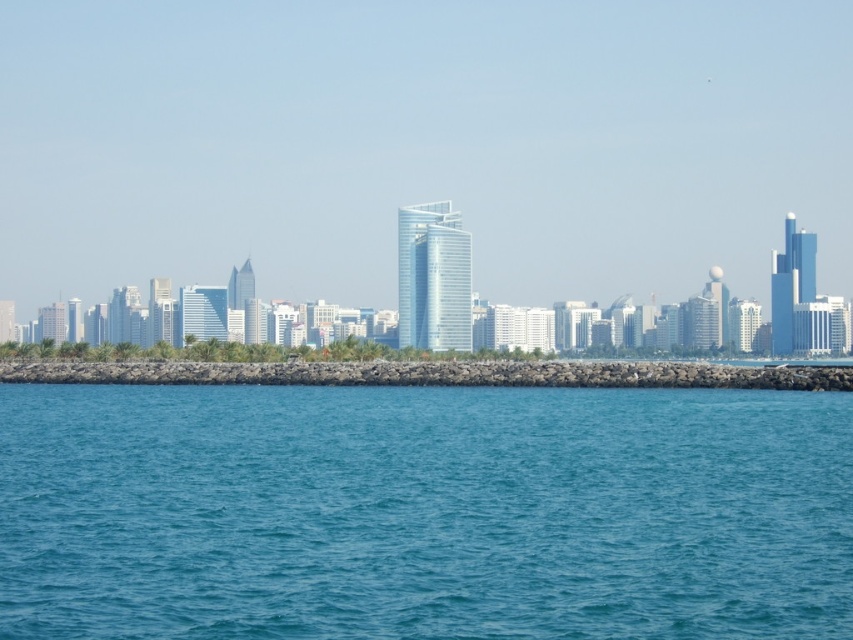
Who is positioned more to the left, blue water at center or rocky barrier at center?

blue water at center is more to the left.

Locate an element on the screen. blue water at center is located at coordinates (422, 512).

What do you see at coordinates (422, 512) in the screenshot? Image resolution: width=853 pixels, height=640 pixels. I see `blue water at center` at bounding box center [422, 512].

The width and height of the screenshot is (853, 640). In order to click on blue water at center in this screenshot , I will do `click(422, 512)`.